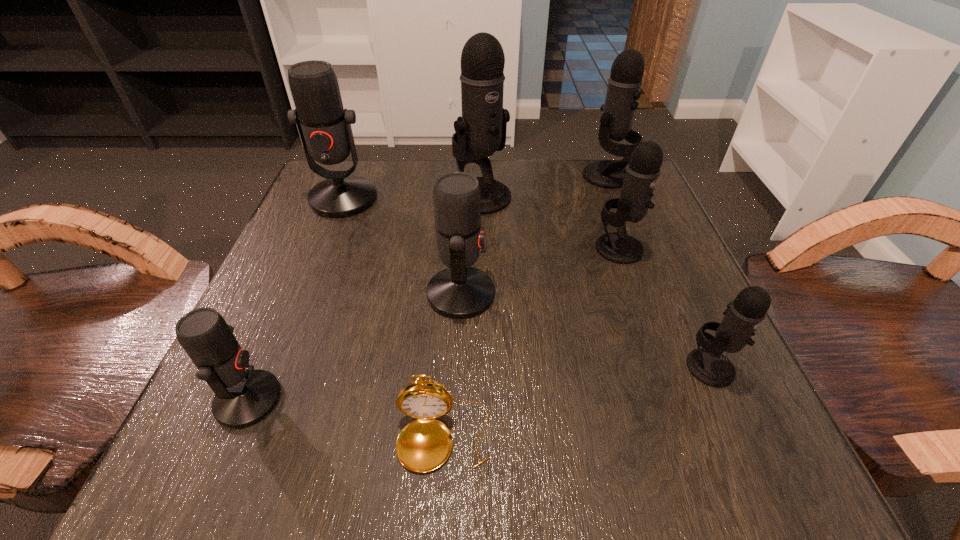
Where is `the shortest object`? the shortest object is located at coordinates (423, 445).

At what (x,y) coordinates should I click in order to perform the action: click on free space located 0.170m on the front of the biggest black microphone. Please return your answer as a coordinate pair (x, y). Looking at the image, I should click on (481, 272).

Image resolution: width=960 pixels, height=540 pixels. In order to click on vacant position located on the left of the second biggest black microphone in this screenshot , I will do `click(509, 176)`.

Locate an element on the screen. blank space located on the side of the farthest red microphone with the red ring is located at coordinates (313, 277).

This screenshot has width=960, height=540. Identify the location of free space located on the side of the second nearest red microphone with the red ring. (524, 294).

Identify the location of vacant space located on the back of the fourth farthest microphone. This screenshot has height=540, width=960. (609, 218).

Locate an element on the screen. The height and width of the screenshot is (540, 960). free spot located 0.340m on the back of the nearest black microphone is located at coordinates (641, 214).

You are a GUI agent. You are given a task and a screenshot of the screen. Output one action in this format:
    pyautogui.click(x=<x>, y=<y>)
    Task: Click on the vacant space located on the side of the smallest red microphone with the red ring
    This screenshot has height=540, width=960.
    Given the screenshot: What is the action you would take?
    pyautogui.click(x=427, y=400)

Identify the location of microphone that is at the near edge. (243, 396).

Locate an element on the screen. The height and width of the screenshot is (540, 960). pocket watch that is at the near edge is located at coordinates (423, 445).